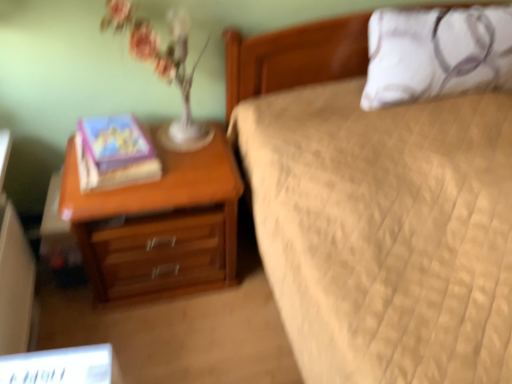
Question: Based on their positions, is matte purple book at left located to the left or right of white textured pillow at upper right?

Choices:
 (A) left
 (B) right

Answer: (A)

Question: Which is correct: matte purple book at left is inside white textured pillow at upper right, or outside of it?

Choices:
 (A) inside
 (B) outside

Answer: (B)

Question: Estimate the real-world distances between objects in this image. Which object is closer to the white textured pillow at upper right?

Choices:
 (A) wooden nightstand at left
 (B) translucent glass vase at upper left
 (C) matte purple book at left

Answer: (B)

Question: Estimate the real-world distances between objects in this image. Which object is closer to the translucent glass vase at upper left?

Choices:
 (A) matte purple book at left
 (B) white textured pillow at upper right
 (C) wooden nightstand at left

Answer: (A)